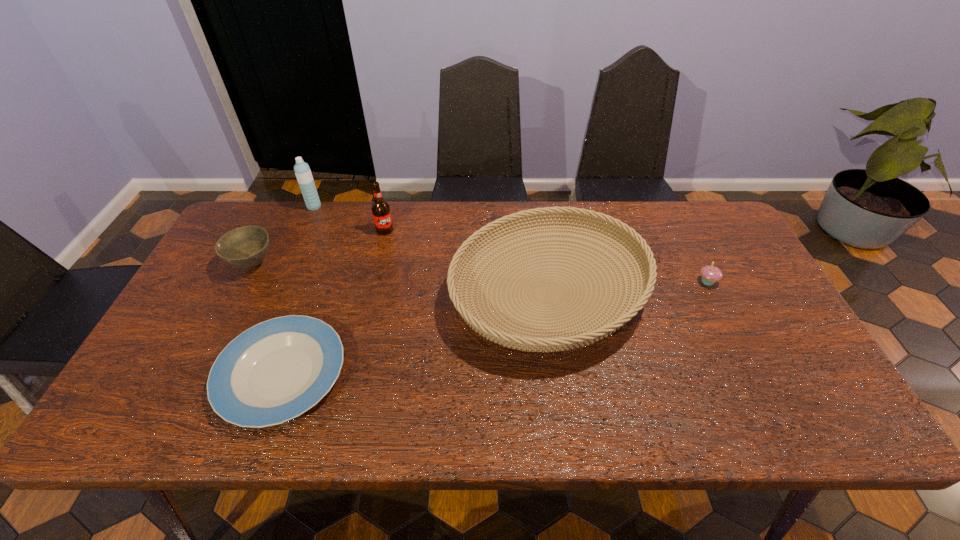
The image size is (960, 540). Identify the location of water bottle. (302, 170).

Identify the location of root beer. (380, 208).

The width and height of the screenshot is (960, 540). Identify the location of the fifth object from left to right. (514, 336).

The width and height of the screenshot is (960, 540). Find the location of `basket`. basket is located at coordinates (514, 336).

At what (x,y) coordinates should I click in order to perform the action: click on bowl. Please return your answer as a coordinate pair (x, y). This screenshot has width=960, height=540. Looking at the image, I should click on (246, 247).

Locate an element on the screen. cupcake is located at coordinates (710, 274).

Image resolution: width=960 pixels, height=540 pixels. Find the location of `the shortest object`. the shortest object is located at coordinates (275, 371).

Identify the location of free region located 0.280m on the front of the farthest object. The image size is (960, 540). (287, 270).

Identify the location of free spot located on the right of the root beer. The height and width of the screenshot is (540, 960). (499, 230).

Locate an element on the screen. vacant space located 0.340m on the left of the fourth shortest object is located at coordinates coord(327,293).